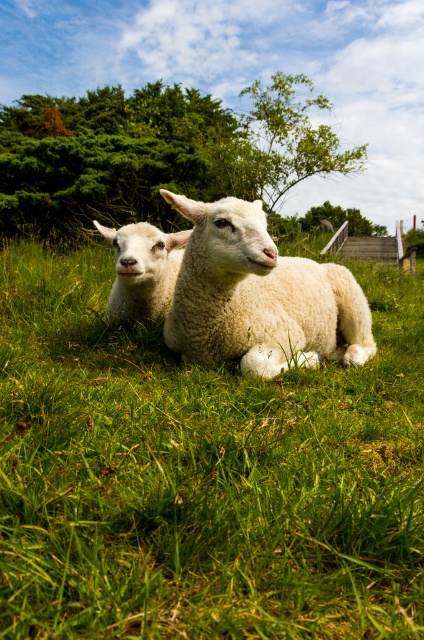
Identify the location of green soft grass at center. (201, 474).

Looking at this image, is green soft grass at center to the right of white woolen sheep at center from the viewer's perspective?

Yes, green soft grass at center is to the right of white woolen sheep at center.

Is point (289, 400) positioned behind point (130, 285)?

No, (289, 400) is in front of (130, 285).

Locate an element on the screen. green soft grass at center is located at coordinates (201, 474).

Who is more forward, (357, 268) or (273, 317)?

Point (273, 317) is more forward.

Is point (296, 604) positioned in front of point (204, 236)?

That is True.

At what (x,y) coordinates should I click in order to perform the action: click on green soft grass at center. Please return your answer as a coordinate pair (x, y). Looking at the image, I should click on (201, 474).

Does point (265, 273) lie behind point (173, 252)?

That is False.

The height and width of the screenshot is (640, 424). I want to click on white fluffy sheep at center, so click(x=259, y=296).